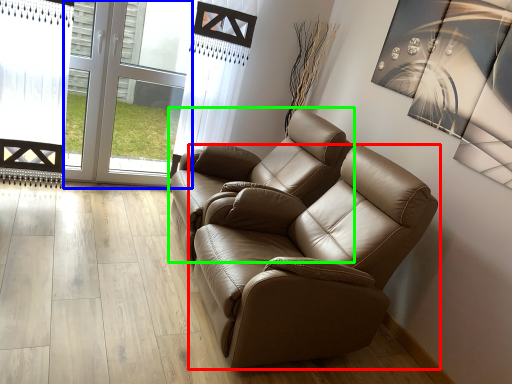
Question: Which object is the farthest from chair (highlighted by a red box)? Choose among these: glass door (highlighted by a blue box) or chair (highlighted by a green box).

Choices:
 (A) glass door
 (B) chair

Answer: (A)